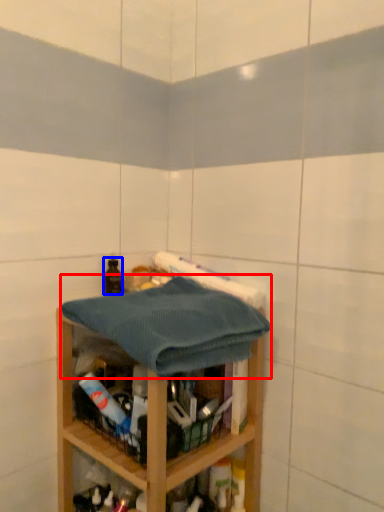
Question: Which point is further to the camera, bath towel (highlighted by a red box) or bottle (highlighted by a blue box)?

Choices:
 (A) bath towel
 (B) bottle

Answer: (B)